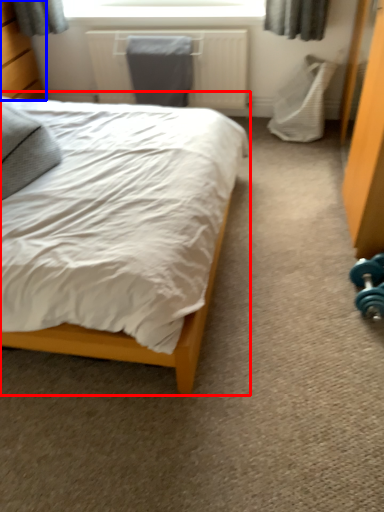
Question: Which object is further to the camera taking this photo, bed (highlighted by a red box) or dresser (highlighted by a blue box)?

Choices:
 (A) bed
 (B) dresser

Answer: (B)